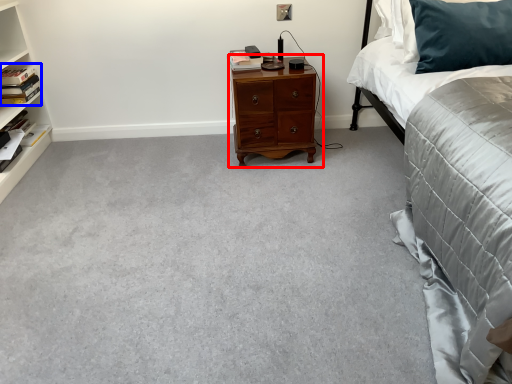
Question: Among these objects, which one is farthest to the camera, nightstand (highlighted by a red box) or book (highlighted by a blue box)?

Choices:
 (A) nightstand
 (B) book

Answer: (B)